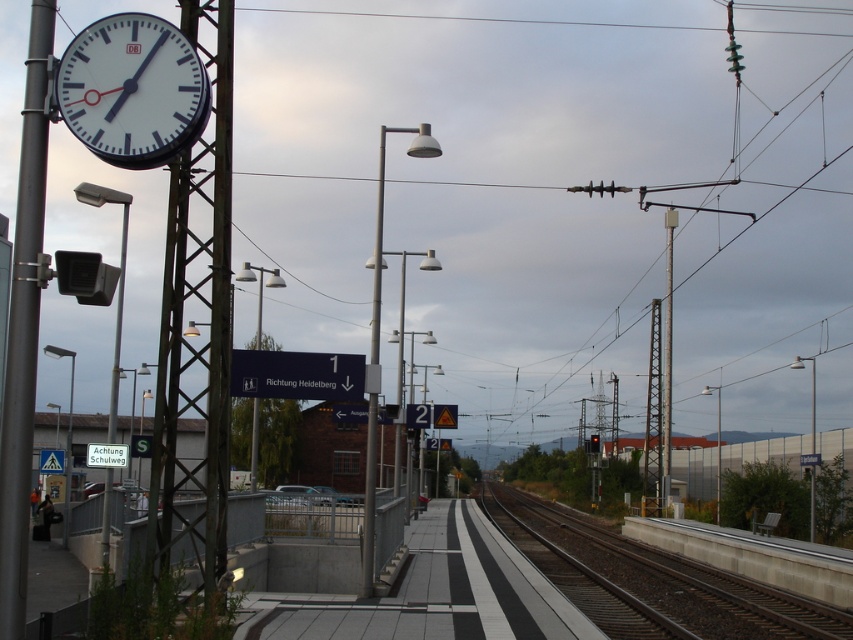
The height and width of the screenshot is (640, 853). Describe the element at coordinates (132, 90) in the screenshot. I see `white matte clock at upper left` at that location.

Is white matte clock at upper left to the right of metallic pole at left from the viewer's perspective?

Indeed, white matte clock at upper left is positioned on the right side of metallic pole at left.

Who is more forward, (141, 51) or (6, 506)?

Point (6, 506) is more forward.

This screenshot has width=853, height=640. What are the coordinates of `white matte clock at upper left` in the screenshot? It's located at (132, 90).

In the scene shown: Is the position of dark brown metal train track at center less distant than that of metallic pole at center-right?

Yes, it is in front of metallic pole at center-right.

Identify the location of dark brown metal train track at center. (665, 582).

Identify the location of dark brown metal train track at center. (665, 582).

Does point (114, 58) lie behind point (670, 320)?

No, it is not.

Which is in front, point (90, 124) or point (664, 372)?

Point (90, 124)

Is point (97, 20) in front of point (670, 320)?

Yes, point (97, 20) is closer to viewer.

Find the location of a particular element. The width and height of the screenshot is (853, 640). white matte clock at upper left is located at coordinates (132, 90).